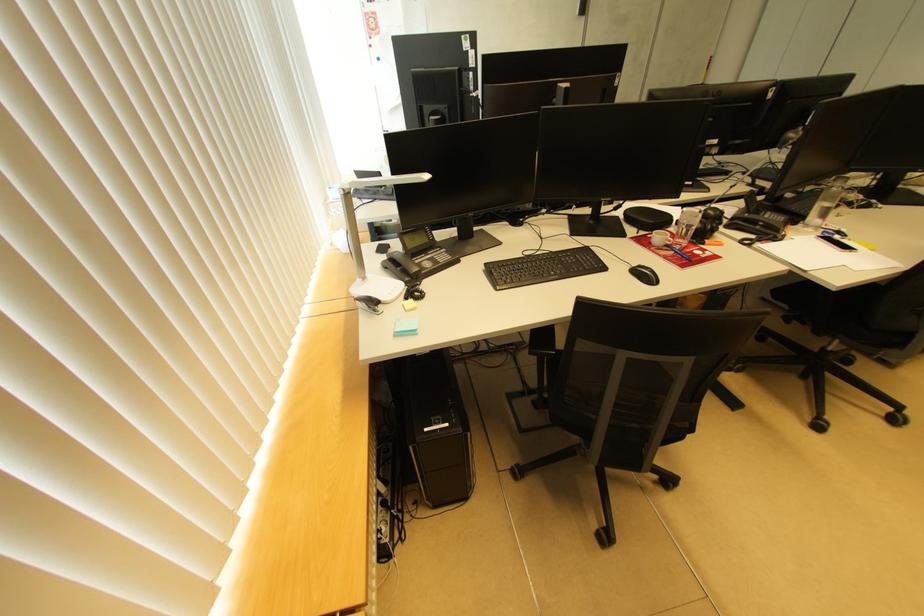
Image resolution: width=924 pixels, height=616 pixels. Describe the element at coordinates (380, 185) in the screenshot. I see `the desk lamp head` at that location.